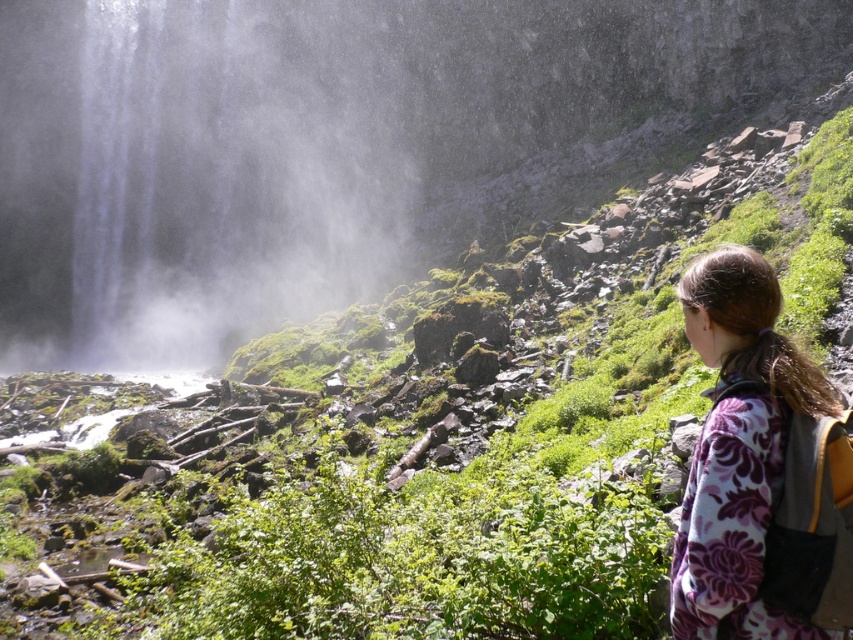
You are a photographer planning to capture the entire scene of the white misty waterfall at upper left and the floral fleece jacket at lower right in one frame. Based on their sizes, which object should you focus on first to ensure both are visible clearly?

The white misty waterfall at upper left is larger in size than the floral fleece jacket at lower right, so you should focus on the white misty waterfall at upper left first to ensure its details are captured clearly while the smaller floral fleece jacket at lower right will still be visible in the frame.

You are standing at the point marked as point (103, 150) in the image. The waterfall is on the left side of the frame. Can you see the waterfall from your current position?

Yes, since the point (103, 150) is positioned on the right side of the image where the person is standing, facing towards the waterfall on the left. The description states that the person is facing the waterfall, so from their position at point (103, 150), they can indeed see the waterfall.

You are a hiker who wants to take a photo of the white misty waterfall at upper left while standing near the floral fleece jacket at lower right. Considering the camera you have can focus up to 50 meters, will you need a telephoto lens to capture the waterfall clearly?

The distance between the white misty waterfall at upper left and the floral fleece jacket at lower right is 68.52 meters. Since your camera can only focus up to 50 meters, you will need a telephoto lens to capture the waterfall clearly from that distance.